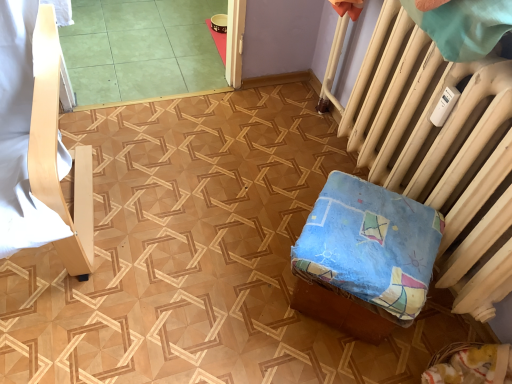
Where is `light wood chair at left, which is the second furniture from right to left`? The height and width of the screenshot is (384, 512). light wood chair at left, which is the second furniture from right to left is located at coordinates (39, 142).

Describe the element at coordinates (141, 49) in the screenshot. I see `green tile at upper left` at that location.

Describe the element at coordinates (365, 256) in the screenshot. Image resolution: width=512 pixels, height=384 pixels. I see `blue fabric cushion at lower right, which appears as the first furniture when viewed from the right` at that location.

Describe the element at coordinates (440, 151) in the screenshot. This screenshot has height=384, width=512. I see `white painted radiator at right` at that location.

Where is `light wood chair at left, which is the second furniture from right to left`? light wood chair at left, which is the second furniture from right to left is located at coordinates (39, 142).

From a real-world perspective, between green tile at upper left and light wood chair at left, the first furniture viewed from the left, who is vertically lower?

green tile at upper left.

Is green tile at upper left aimed at light wood chair at left, which is the second furniture from right to left?

No, green tile at upper left is not aimed at light wood chair at left, which is the second furniture from right to left.

Based on the photo, is green tile at upper left taller than light wood chair at left, which is the second furniture from right to left?

No.

From the image's perspective, between green tile at upper left and light wood chair at left, which is the second furniture from right to left, which one is located above?

green tile at upper left is shown above in the image.

Is point (330, 283) positioned in front of point (97, 77)?

Yes.

From the image's perspective, is blue fabric cushion at lower right, which appears as the first furniture when viewed from the right, positioned above or below green tile at upper left?

Clearly, from the image's perspective, blue fabric cushion at lower right, which appears as the first furniture when viewed from the right, is below green tile at upper left.

Can you confirm if blue fabric cushion at lower right, marked as the second furniture in a left-to-right arrangement, is shorter than green tile at upper left?

In fact, blue fabric cushion at lower right, marked as the second furniture in a left-to-right arrangement, may be taller than green tile at upper left.

Which object is wider, blue fabric cushion at lower right, which appears as the first furniture when viewed from the right, or green tile at upper left?

Wider between the two is green tile at upper left.

Who is smaller, white painted radiator at right or blue fabric cushion at lower right, which appears as the first furniture when viewed from the right?

Smaller between the two is blue fabric cushion at lower right, which appears as the first furniture when viewed from the right.

Between point (500, 64) and point (400, 210), which one is positioned in front?

The point (500, 64) is closer.

From a real-world perspective, is white painted radiator at right beneath blue fabric cushion at lower right, marked as the second furniture in a left-to-right arrangement?

Actually, white painted radiator at right is physically above blue fabric cushion at lower right, marked as the second furniture in a left-to-right arrangement, in the real world.

Is blue fabric cushion at lower right, which appears as the first furniture when viewed from the right, a part of white painted radiator at right?

No, blue fabric cushion at lower right, which appears as the first furniture when viewed from the right, is not surrounded by white painted radiator at right.

Could white painted radiator at right be considered to be inside light wood chair at left, the first furniture viewed from the left?

No, white painted radiator at right is not surrounded by light wood chair at left, the first furniture viewed from the left.

Which object is positioned more to the right, light wood chair at left, the first furniture viewed from the left, or white painted radiator at right?

white painted radiator at right.

Considering the sizes of light wood chair at left, the first furniture viewed from the left, and white painted radiator at right in the image, is light wood chair at left, the first furniture viewed from the left, wider or thinner than white painted radiator at right?

light wood chair at left, the first furniture viewed from the left, is wider than white painted radiator at right.

Consider the image. Measure the distance between green tile at upper left and white painted radiator at right.

green tile at upper left and white painted radiator at right are 3.87 feet apart.

In the scene shown: Which point is more distant from viewer, (138, 20) or (494, 111)?

Point (138, 20)

In the scene shown: Is green tile at upper left not close to white painted radiator at right?

Yes, green tile at upper left and white painted radiator at right are located far from each other.

From the image's perspective, is green tile at upper left under white painted radiator at right?

Incorrect, from the image's perspective, green tile at upper left is higher than white painted radiator at right.

Considering the relative sizes of white painted radiator at right and green tile at upper left in the image provided, is white painted radiator at right taller than green tile at upper left?

Yes.

From a real-world perspective, is white painted radiator at right above or below green tile at upper left?

white painted radiator at right is above green tile at upper left.

Relative to green tile at upper left, is white painted radiator at right in front or behind?

white painted radiator at right is positioned closer to the viewer than green tile at upper left.

How far apart are white painted radiator at right and green tile at upper left?

3.87 feet.

Is blue fabric cushion at lower right, which appears as the first furniture when viewed from the right, beside light wood chair at left, the first furniture viewed from the left?

blue fabric cushion at lower right, which appears as the first furniture when viewed from the right, and light wood chair at left, the first furniture viewed from the left, are clearly separated.

Can you confirm if blue fabric cushion at lower right, which appears as the first furniture when viewed from the right, is shorter than light wood chair at left, which is the second furniture from right to left?

Indeed, blue fabric cushion at lower right, which appears as the first furniture when viewed from the right, has a lesser height compared to light wood chair at left, which is the second furniture from right to left.

Is blue fabric cushion at lower right, which appears as the first furniture when viewed from the right, not within light wood chair at left, the first furniture viewed from the left?

Yes, blue fabric cushion at lower right, which appears as the first furniture when viewed from the right, is not within light wood chair at left, the first furniture viewed from the left.

Does blue fabric cushion at lower right, which appears as the first furniture when viewed from the right, have a lesser width compared to light wood chair at left, which is the second furniture from right to left?

Yes, blue fabric cushion at lower right, which appears as the first furniture when viewed from the right, is thinner than light wood chair at left, which is the second furniture from right to left.

Identify the location of tile behind the light wood chair at left, the first furniture viewed from the left. (141, 49).

Find the location of a particular element. tile located above the blue fabric cushion at lower right, marked as the second furniture in a left-to-right arrangement (from the image's perspective) is located at coordinates (141, 49).

Considering their positions, is green tile at upper left positioned further to light wood chair at left, the first furniture viewed from the left, than blue fabric cushion at lower right, marked as the second furniture in a left-to-right arrangement?

green tile at upper left is further to light wood chair at left, the first furniture viewed from the left.

When comparing their distances from light wood chair at left, the first furniture viewed from the left, does blue fabric cushion at lower right, marked as the second furniture in a left-to-right arrangement, or green tile at upper left seem closer?

Based on the image, blue fabric cushion at lower right, marked as the second furniture in a left-to-right arrangement, appears to be nearer to light wood chair at left, the first furniture viewed from the left.

When comparing their distances from green tile at upper left, does blue fabric cushion at lower right, which appears as the first furniture when viewed from the right, or white painted radiator at right seem closer?

The object closer to green tile at upper left is white painted radiator at right.

Based on their spatial positions, is light wood chair at left, the first furniture viewed from the left, or blue fabric cushion at lower right, which appears as the first furniture when viewed from the right, further from green tile at upper left?

blue fabric cushion at lower right, which appears as the first furniture when viewed from the right, is further to green tile at upper left.

Looking at the image, which one is located closer to white painted radiator at right, green tile at upper left or light wood chair at left, which is the second furniture from right to left?

The object closer to white painted radiator at right is light wood chair at left, which is the second furniture from right to left.

Considering their positions, is light wood chair at left, which is the second furniture from right to left, positioned closer to white painted radiator at right than blue fabric cushion at lower right, marked as the second furniture in a left-to-right arrangement?

Based on the image, blue fabric cushion at lower right, marked as the second furniture in a left-to-right arrangement, appears to be nearer to white painted radiator at right.

Estimate the real-world distances between objects in this image. Which object is closer to green tile at upper left, light wood chair at left, which is the second furniture from right to left, or white painted radiator at right?

Based on the image, light wood chair at left, which is the second furniture from right to left, appears to be nearer to green tile at upper left.

Considering their positions, is blue fabric cushion at lower right, marked as the second furniture in a left-to-right arrangement, positioned closer to light wood chair at left, which is the second furniture from right to left, than white painted radiator at right?

The object closer to light wood chair at left, which is the second furniture from right to left, is blue fabric cushion at lower right, marked as the second furniture in a left-to-right arrangement.

Where is `radiator between light wood chair at left, the first furniture viewed from the left, and green tile at upper left from front to back`? This screenshot has width=512, height=384. radiator between light wood chair at left, the first furniture viewed from the left, and green tile at upper left from front to back is located at coordinates (440, 151).

Where is `furniture between light wood chair at left, which is the second furniture from right to left, and green tile at upper left in the front-back direction`? Image resolution: width=512 pixels, height=384 pixels. furniture between light wood chair at left, which is the second furniture from right to left, and green tile at upper left in the front-back direction is located at coordinates (365, 256).

At what (x,y) coordinates should I click in order to perform the action: click on furniture between white painted radiator at right and green tile at upper left from front to back. Please return your answer as a coordinate pair (x, y). Looking at the image, I should click on (365, 256).

Identify the location of furniture situated between light wood chair at left, the first furniture viewed from the left, and white painted radiator at right from left to right. The image size is (512, 384). (365, 256).